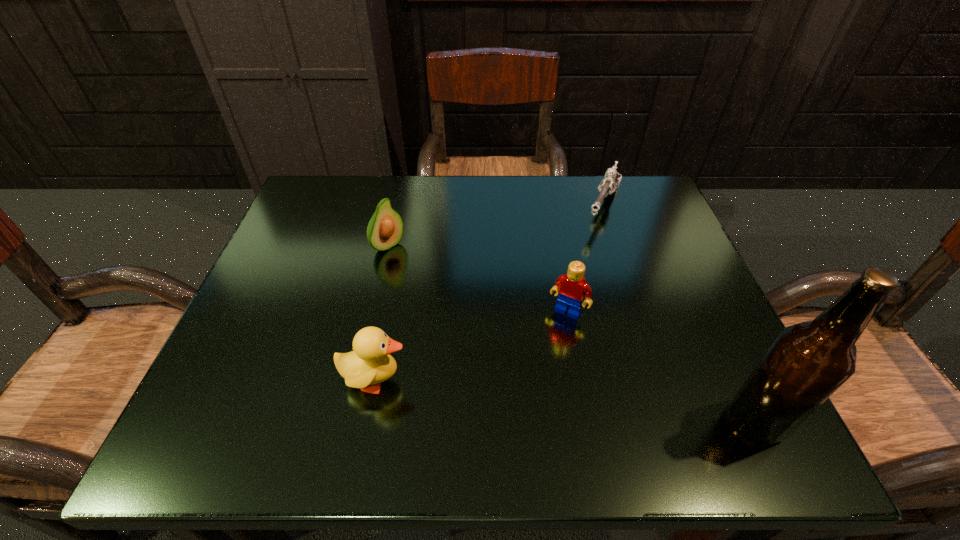
I want to click on free space located on the front-facing side of the third farthest object, so click(x=525, y=381).

Where is `free region located on the front-facing side of the third farthest object`? free region located on the front-facing side of the third farthest object is located at coordinates (549, 339).

In order to click on vacant space located on the cut side of the avocado in this screenshot , I will do `click(491, 326)`.

The height and width of the screenshot is (540, 960). What are the coordinates of `vacant space located on the cut side of the avocado` in the screenshot? It's located at (458, 301).

I want to click on vacant position located on the cut side of the avocado, so click(x=416, y=268).

This screenshot has height=540, width=960. I want to click on free point located aimed along the barrel of the gun, so click(x=593, y=245).

Where is `vacant region located 0.090m aimed along the barrel of the gun`? vacant region located 0.090m aimed along the barrel of the gun is located at coordinates (590, 253).

This screenshot has height=540, width=960. Identify the location of free space located aimed along the barrel of the gun. (593, 245).

You are a GUI agent. You are given a task and a screenshot of the screen. Output one action in this format:
    pyautogui.click(x=<x>, y=<y>)
    Task: Click on the object situated at the far edge
    
    Given the screenshot: What is the action you would take?
    pyautogui.click(x=612, y=178)

Locate an element on the screen. The width and height of the screenshot is (960, 540). duckling that is at the near edge is located at coordinates (370, 363).